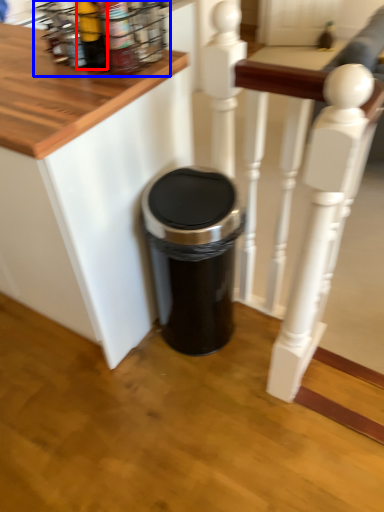
Question: Which of the following is the farthest to the observer, bottle (highlighted by a red box) or spice rack (highlighted by a blue box)?

Choices:
 (A) bottle
 (B) spice rack

Answer: (B)